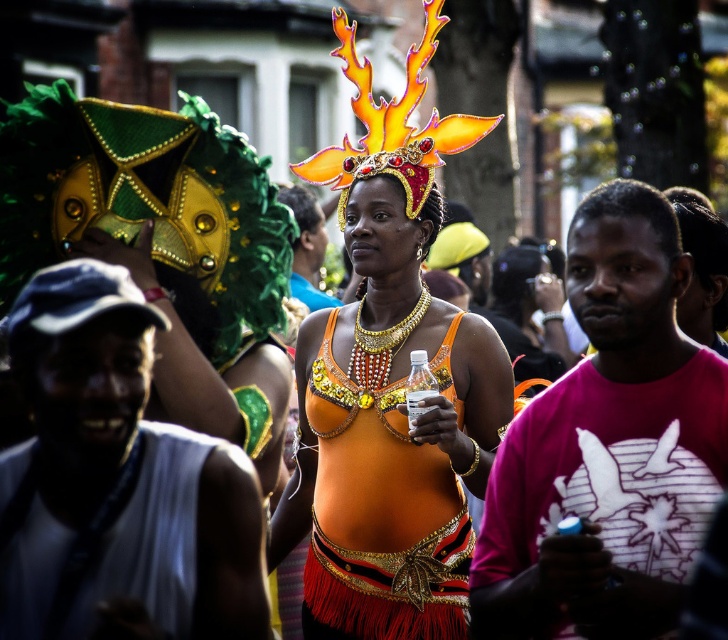
Is orange sequined top at center bigger than white fabric shirt at center?

Yes.

Which is below, orange sequined top at center or white fabric shirt at center?

white fabric shirt at center is lower down.

Locate an element on the screen. Image resolution: width=728 pixels, height=640 pixels. orange sequined top at center is located at coordinates (379, 516).

The width and height of the screenshot is (728, 640). What are the coordinates of `orange sequined top at center` in the screenshot? It's located at (379, 516).

Consider the image. Is pink fabric shirt at right bigger than orange sequined top at center?

Indeed, pink fabric shirt at right has a larger size compared to orange sequined top at center.

Who is more distant from viewer, (585, 444) or (365, 429)?

Positioned behind is point (365, 429).

Does point (513, 464) come in front of point (312, 564)?

Yes, it is.

Find the location of a particular element. The image size is (728, 640). pink fabric shirt at right is located at coordinates (606, 488).

Between pink fabric shirt at right and white fabric shirt at center, which one has less height?

white fabric shirt at center is shorter.

Measure the distance from pink fabric shirt at right to white fabric shirt at center.

pink fabric shirt at right and white fabric shirt at center are 13.61 meters apart.

Locate an element on the screen. Image resolution: width=728 pixels, height=640 pixels. pink fabric shirt at right is located at coordinates (606, 488).